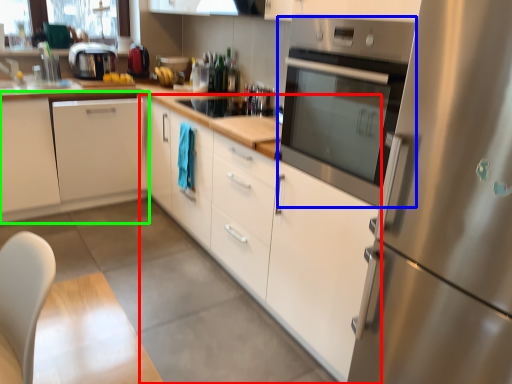
Question: Based on their relative distances, which object is nearer to cabinetry (highlighted by a red box)? Choose from home appliance (highlighted by a blue box) and cabinetry (highlighted by a green box).

Choices:
 (A) home appliance
 (B) cabinetry

Answer: (A)